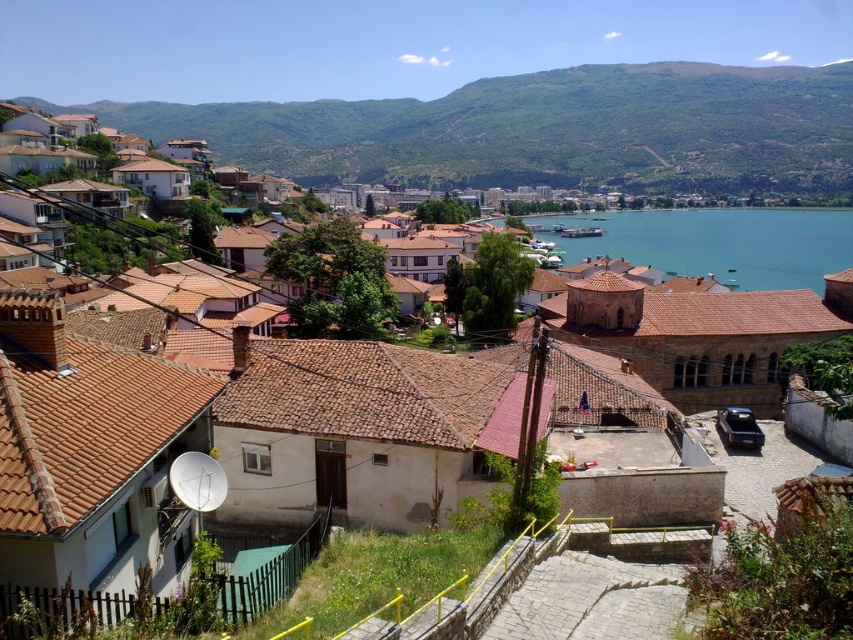
Question: Among these objects, which one is farthest from the camera?

Choices:
 (A) green grassy hillside at upper center
 (B) blue water at center

Answer: (A)

Question: Does green grassy hillside at upper center have a smaller size compared to blue water at center?

Choices:
 (A) no
 (B) yes

Answer: (A)

Question: Does green grassy hillside at upper center have a smaller size compared to blue water at center?

Choices:
 (A) no
 (B) yes

Answer: (A)

Question: Does green grassy hillside at upper center appear over blue water at center?

Choices:
 (A) no
 (B) yes

Answer: (B)